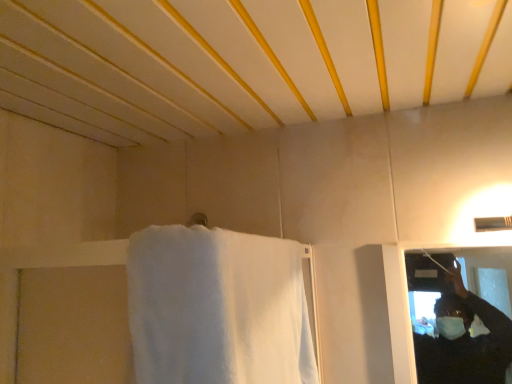
The width and height of the screenshot is (512, 384). What do you see at coordinates (217, 308) in the screenshot?
I see `white fluffy towel at center` at bounding box center [217, 308].

In order to click on white fluffy towel at center in this screenshot , I will do `click(217, 308)`.

Image resolution: width=512 pixels, height=384 pixels. In order to click on white fluffy towel at center in this screenshot , I will do `click(217, 308)`.